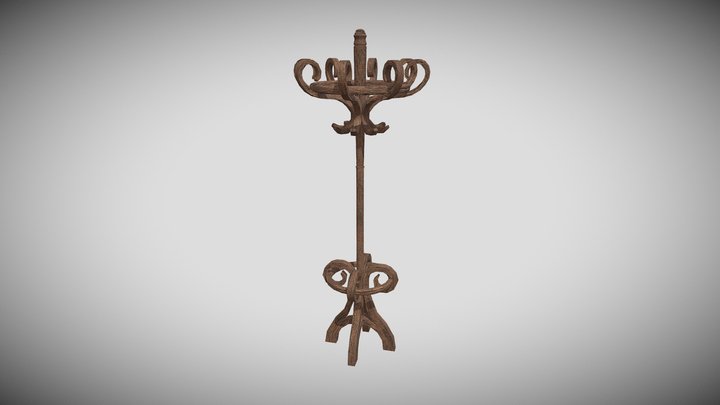
Where is `bottom section of coat rack`? bottom section of coat rack is located at coordinates (354, 290).